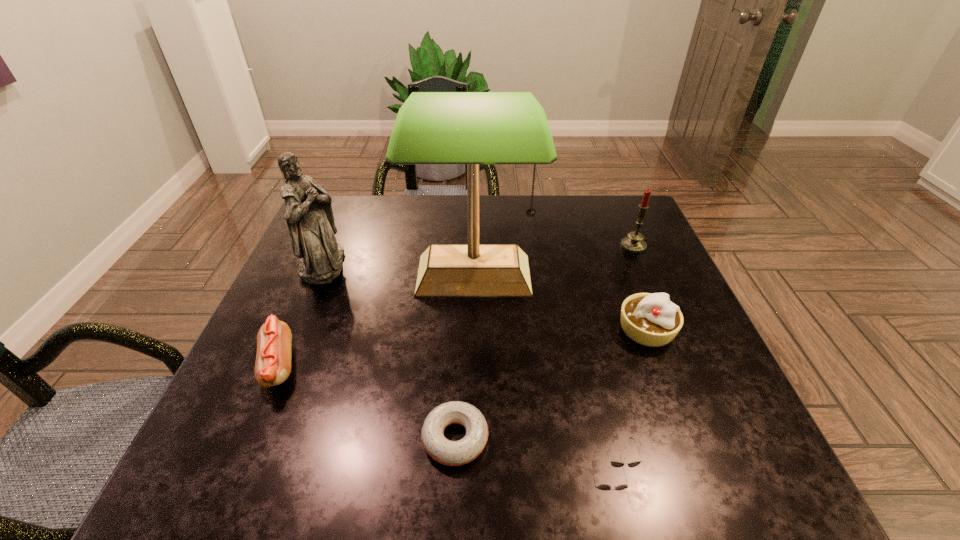
The width and height of the screenshot is (960, 540). In order to click on vacant region located on the front of the candle in this screenshot , I will do `click(656, 298)`.

Find the location of a particular element. The image size is (960, 540). vacant area located 0.180m on the back of the fourth tallest object is located at coordinates (620, 260).

Identify the location of vacant region located on the back of the sausage. pyautogui.click(x=335, y=231).

This screenshot has height=540, width=960. I want to click on free space located 0.090m on the back of the doughnut, so click(459, 369).

You are a GUI agent. You are given a task and a screenshot of the screen. Output one action in this format:
    pyautogui.click(x=<x>, y=<y>)
    Task: Click on the object situated at the far edge
    The height and width of the screenshot is (540, 960).
    Given the screenshot: What is the action you would take?
    pyautogui.click(x=633, y=243)

You are a GUI agent. You are given a task and a screenshot of the screen. Output one action in this format:
    pyautogui.click(x=<x>, y=<y>)
    Task: Click on the sunglasses that is at the near edge
    The width and height of the screenshot is (960, 540).
    Given the screenshot: What is the action you would take?
    pyautogui.click(x=617, y=464)

You are a GUI agent. You are given a task and a screenshot of the screen. Output one action in this format:
    pyautogui.click(x=<x>, y=<y>)
    Task: Click on the doughnut positioned at the near edge
    
    Given the screenshot: What is the action you would take?
    pyautogui.click(x=451, y=453)

Find the location of `figurine present at the left edge`. figurine present at the left edge is located at coordinates (309, 215).

Locate an element on the screen. sausage present at the left edge is located at coordinates (273, 359).

Find the location of a particular element. Image resolution: width=960 pixels, height=540 pixels. candle that is at the right edge is located at coordinates (633, 243).